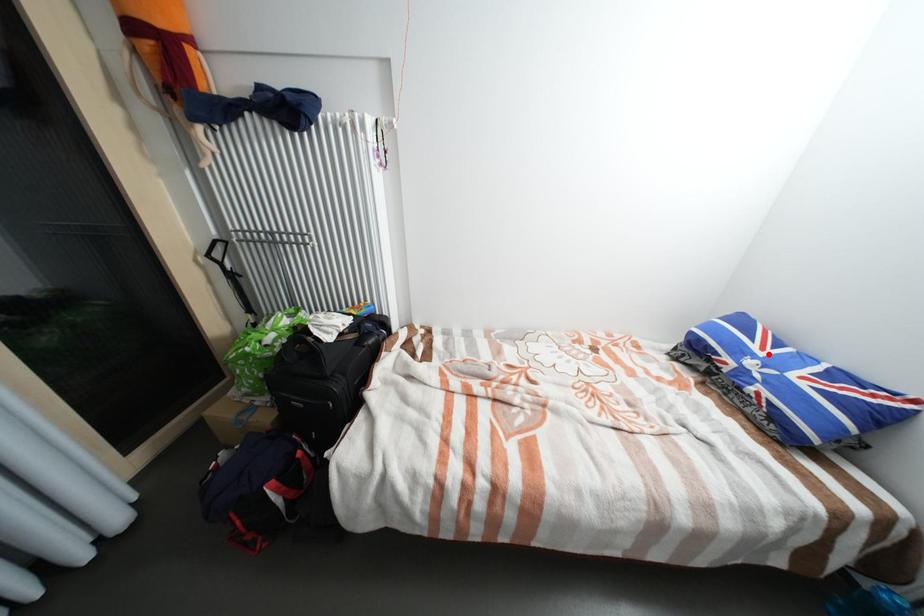
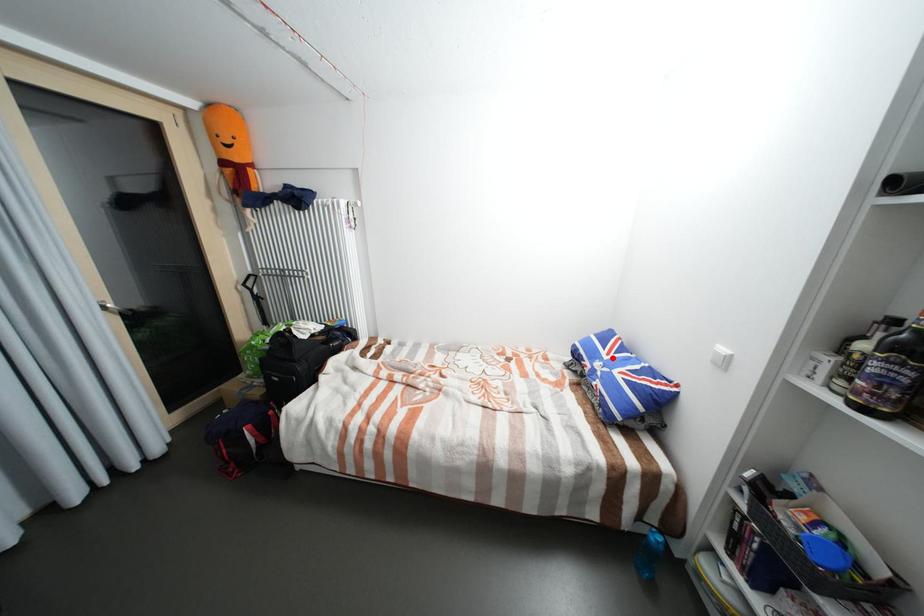
I am providing you with two images of the same scene from different viewpoints. A red point is marked on the first image and another point is marked on the second image. Does the point marked in image1 correspond to the same location as the one in image2?

Yes